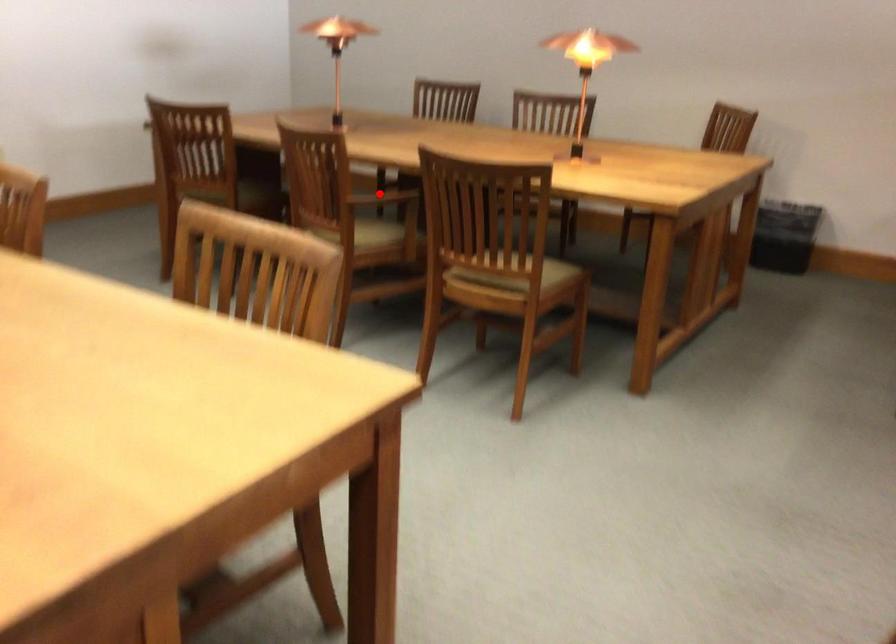
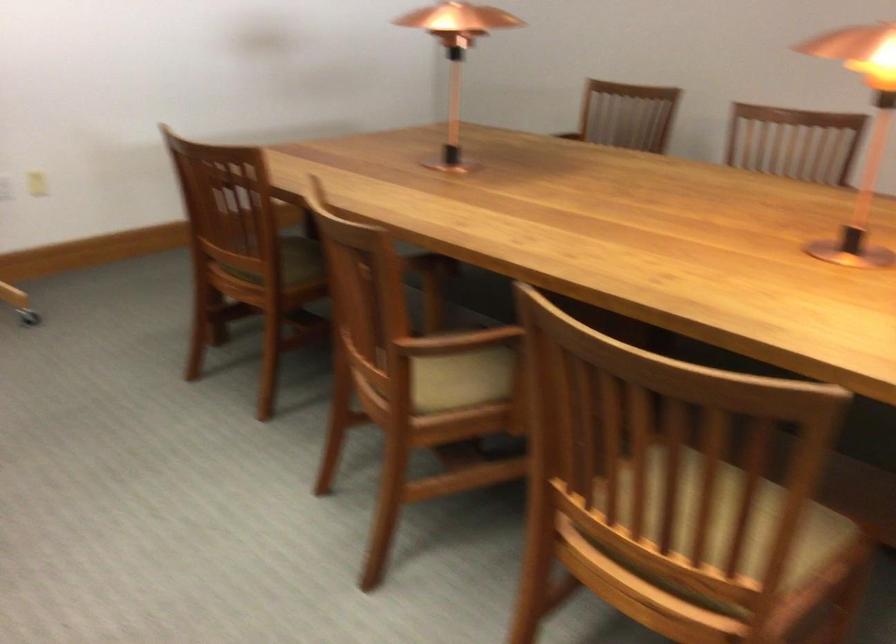
Question: I am providing you with two images of the same scene from different viewpoints. Image1 has a red point marked. In image2, the corresponding 3D location appears at what relative position? Reply with the corresponding letter.

Choices:
 (A) Closer
 (B) Farther

Answer: (A)